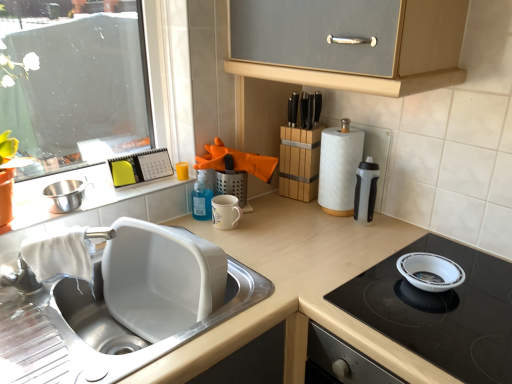
Question: Are matte white countertop at center and translucent plastic water bottle at right far apart?

Choices:
 (A) no
 (B) yes

Answer: (A)

Question: Does matte white countertop at center have a greater width compared to translucent plastic water bottle at right?

Choices:
 (A) yes
 (B) no

Answer: (A)

Question: Is matte white countertop at center oriented away from translucent plastic water bottle at right?

Choices:
 (A) yes
 (B) no

Answer: (B)

Question: Considering the relative sizes of matte white countertop at center and translucent plastic water bottle at right in the image provided, is matte white countertop at center bigger than translucent plastic water bottle at right?

Choices:
 (A) no
 (B) yes

Answer: (B)

Question: Is matte white countertop at center thinner than translucent plastic water bottle at right?

Choices:
 (A) no
 (B) yes

Answer: (A)

Question: In the image, is white glossy sink at lower left positioned in front of or behind white glossy bowl at upper right?

Choices:
 (A) behind
 (B) front

Answer: (B)

Question: From a real-world perspective, is white glossy sink at lower left above or below white glossy bowl at upper right?

Choices:
 (A) below
 (B) above

Answer: (A)

Question: Is point (187, 319) positioned closer to the camera than point (436, 344)?

Choices:
 (A) closer
 (B) farther

Answer: (B)

Question: Which is correct: white glossy sink at lower left is inside white glossy bowl at upper right, or outside of it?

Choices:
 (A) outside
 (B) inside

Answer: (A)

Question: Looking at their shapes, would you say white glossy window sill at upper left is wider or thinner than translucent plastic water bottle at right?

Choices:
 (A) thin
 (B) wide

Answer: (B)

Question: Do you think white glossy window sill at upper left is within translucent plastic water bottle at right, or outside of it?

Choices:
 (A) inside
 (B) outside

Answer: (B)

Question: Considering the positions of point (80, 215) and point (358, 173), is point (80, 215) closer or farther from the camera than point (358, 173)?

Choices:
 (A) closer
 (B) farther

Answer: (A)

Question: From the image's perspective, is white glossy window sill at upper left above or below translucent plastic water bottle at right?

Choices:
 (A) below
 (B) above

Answer: (A)

Question: Looking at the image, does white glossy sink at lower left seem bigger or smaller compared to white glossy window sill at upper left?

Choices:
 (A) small
 (B) big

Answer: (B)

Question: Based on their positions, is white glossy sink at lower left located to the left or right of white glossy window sill at upper left?

Choices:
 (A) left
 (B) right

Answer: (B)